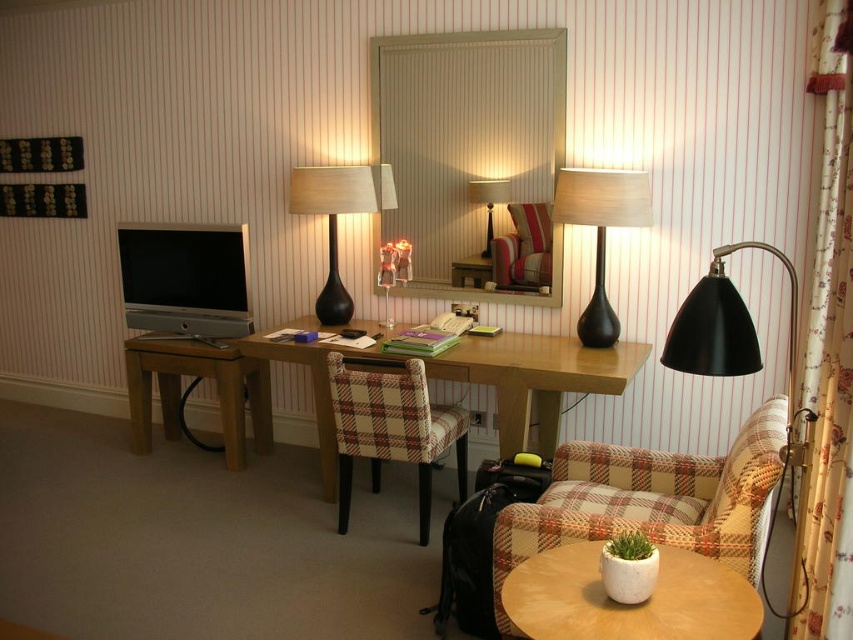
You are standing in the hotel room and need to place a new decorative item on the wooden desk at center. According to the room layout, where exactly should you place it?

The wooden desk at center is located at point (535, 378), so you should place the decorative item there.

You are standing in the hotel room and need to place a decorative item on the table that is to the left of the black glass table lamp at center. Which table should you choose between the white ceramic table at lower right and another table not mentioned?

The white ceramic table at lower right is to the right of the black glass table lamp at center, so the other table not mentioned must be to the left. Choose the unmentioned table.

You are a delivery person trying to place a rectangular package that is 1 meter wide on the floor. You see the white ceramic table at lower right and the matte black lamp at right. Which object has enough width to place the package next to it without overlapping?

The white ceramic table at lower right might be wider than matte black lamp at right, so it is more likely to have enough space next to it for the 1 meter wide package.